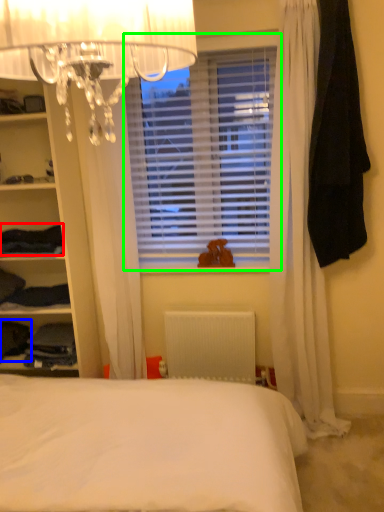
Question: Which is farther away from clothing (highlighted by a red box)? clothing (highlighted by a blue box) or window blind (highlighted by a green box)?

Choices:
 (A) clothing
 (B) window blind

Answer: (B)